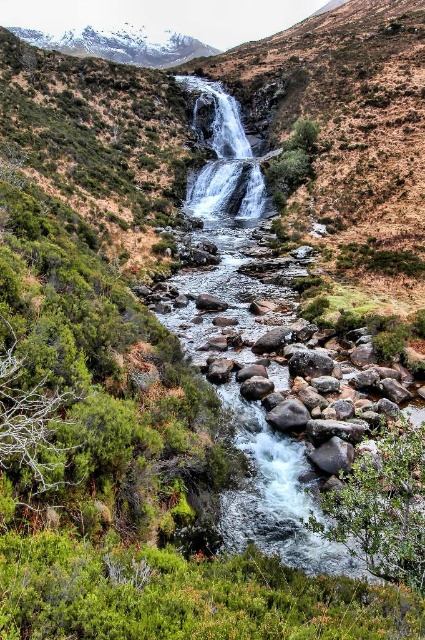
You are planning to cross the white smooth water at center using a small wooden bridge. However, you notice the snowy granite mountain at upper left in the background. Which object takes up more area in the image?

The snowy granite mountain at upper left occupies more area in the image than the white smooth water at center, as the white smooth water at center occupies less space than snowy granite mountain at upper left.

You are a hiker standing at the base of the snowy granite mountain at upper left and want to reach the white smooth water at center. Given that your average hiking pace is 1.5 meters per second, how many minutes will it take you to reach the water if you walk directly towards it?

The distance between the snowy granite mountain at upper left and the white smooth water at center is 443.18 meters. At a pace of 1.5 meters per second, the time required is 443.18 divided by 1.5, which equals approximately 295.45 seconds. Converting seconds to minutes gives roughly 4.92 minutes. Therefore, it will take about 5 minutes to reach the white smooth water at center.